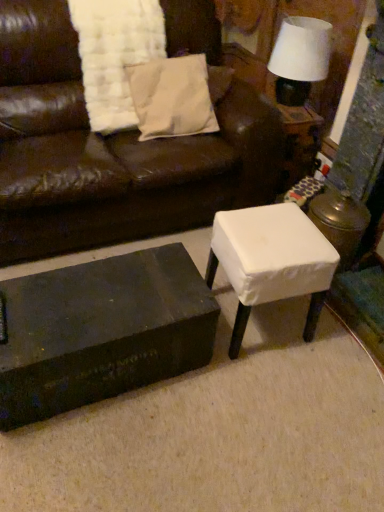
Where is `vacant region to the right of white fabric stool at center`? Image resolution: width=384 pixels, height=512 pixels. vacant region to the right of white fabric stool at center is located at coordinates (336, 337).